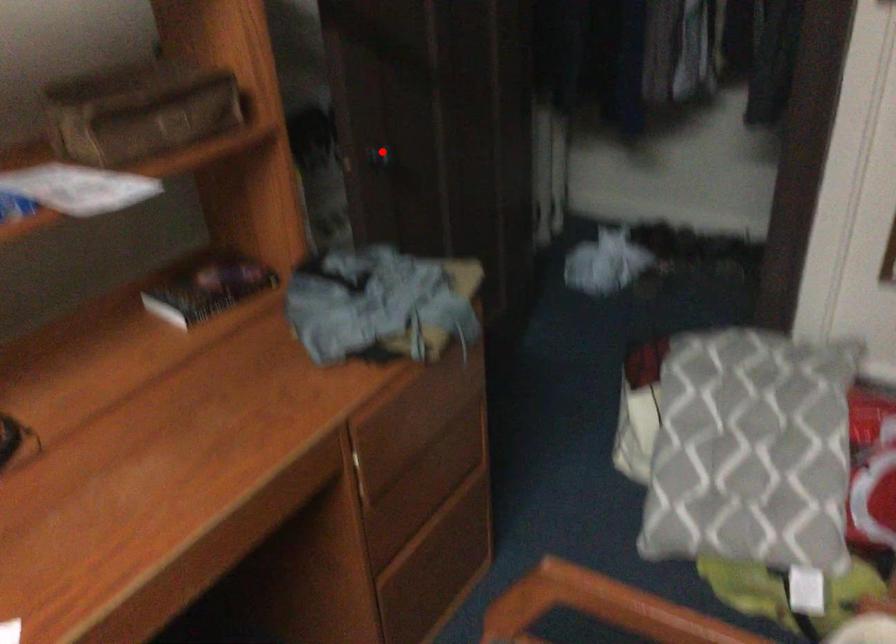
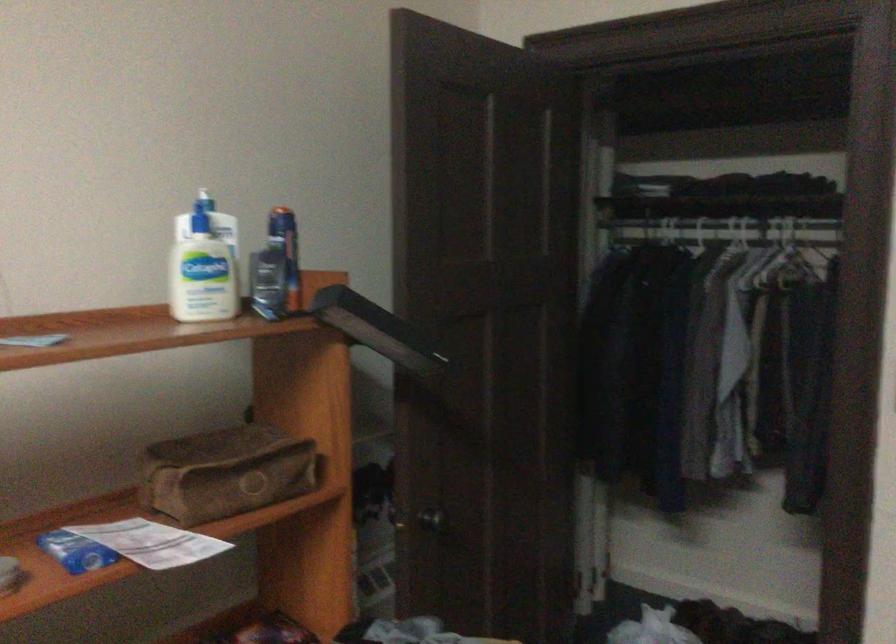
Locate, in the second image, the point that corresponds to the highlighted location in the first image.

(433, 520)